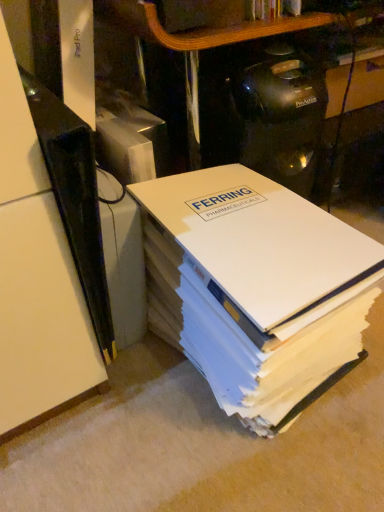
Question: Considering the relative positions of black plastic shelf at left and white paper at center in the image provided, is black plastic shelf at left to the left of white paper at center from the viewer's perspective?

Choices:
 (A) yes
 (B) no

Answer: (A)

Question: Is black plastic shelf at left shorter than white paper at center?

Choices:
 (A) yes
 (B) no

Answer: (B)

Question: Considering the relative positions of black plastic shelf at left and white paper at center in the image provided, is black plastic shelf at left to the right of white paper at center from the viewer's perspective?

Choices:
 (A) yes
 (B) no

Answer: (B)

Question: Considering the relative sizes of black plastic shelf at left and white paper at center in the image provided, is black plastic shelf at left wider than white paper at center?

Choices:
 (A) yes
 (B) no

Answer: (A)

Question: Is black plastic shelf at left thinner than white paper at center?

Choices:
 (A) yes
 (B) no

Answer: (B)

Question: Is black plastic shelf at left not inside white paper at center?

Choices:
 (A) yes
 (B) no

Answer: (A)

Question: Considering the relative sizes of white paper at center and black plastic shelf at left in the image provided, is white paper at center smaller than black plastic shelf at left?

Choices:
 (A) yes
 (B) no

Answer: (B)

Question: Considering the relative sizes of white paper at center and black plastic shelf at left in the image provided, is white paper at center thinner than black plastic shelf at left?

Choices:
 (A) no
 (B) yes

Answer: (B)

Question: Is white paper at center aimed at black plastic shelf at left?

Choices:
 (A) yes
 (B) no

Answer: (B)

Question: From a real-world perspective, is white paper at center physically below black plastic shelf at left?

Choices:
 (A) yes
 (B) no

Answer: (A)

Question: Considering the relative positions of white paper at center and black plastic shelf at left in the image provided, is white paper at center to the left of black plastic shelf at left from the viewer's perspective?

Choices:
 (A) no
 (B) yes

Answer: (A)

Question: From the image's perspective, does white paper at center appear lower than black plastic shelf at left?

Choices:
 (A) yes
 (B) no

Answer: (A)

Question: Considering the positions of white paper at center and black plastic shelf at left in the image, is white paper at center taller or shorter than black plastic shelf at left?

Choices:
 (A) tall
 (B) short

Answer: (B)